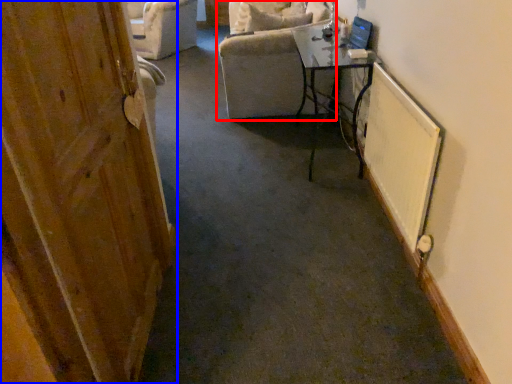
Question: Which object is closer to the camera taking this photo, chair (highlighted by a red box) or door (highlighted by a blue box)?

Choices:
 (A) chair
 (B) door

Answer: (B)